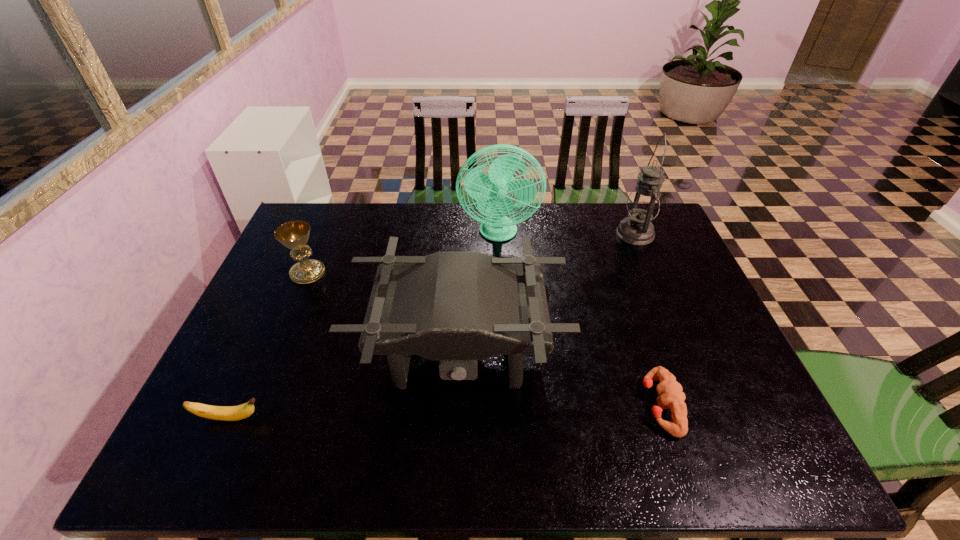
You are a GUI agent. You are given a task and a screenshot of the screen. Output one action in this format:
    pyautogui.click(x=<x>, y=<y>)
    Task: Click on the oil lamp
    This screenshot has width=960, height=540.
    Given the screenshot: What is the action you would take?
    pyautogui.click(x=643, y=204)

Where is `fan`? fan is located at coordinates (490, 191).

You are a GUI agent. You are given a task and a screenshot of the screen. Output one action in this format:
    pyautogui.click(x=<x>, y=<y>)
    Task: Click on the third tallest object
    
    Given the screenshot: What is the action you would take?
    pyautogui.click(x=458, y=307)

Locate an element on the screen. the third farthest object is located at coordinates [x=294, y=235].

Where is `chalice`? This screenshot has height=540, width=960. chalice is located at coordinates (294, 235).

This screenshot has height=540, width=960. I want to click on banana, so click(x=223, y=413).

Locate an element on the screen. This screenshot has height=540, width=960. puncher is located at coordinates (670, 393).

At what (x,y) coordinates should I click in order to perform the action: click on the shortest object. Please return your answer as a coordinate pair (x, y). The height and width of the screenshot is (540, 960). Looking at the image, I should click on (670, 393).

Where is `vacant space located 0.360m on the front of the oil lamp`? Image resolution: width=960 pixels, height=540 pixels. vacant space located 0.360m on the front of the oil lamp is located at coordinates (678, 335).

Where is `vacant space located 0.050m in front of the fan to blow air`? The image size is (960, 540). vacant space located 0.050m in front of the fan to blow air is located at coordinates (500, 260).